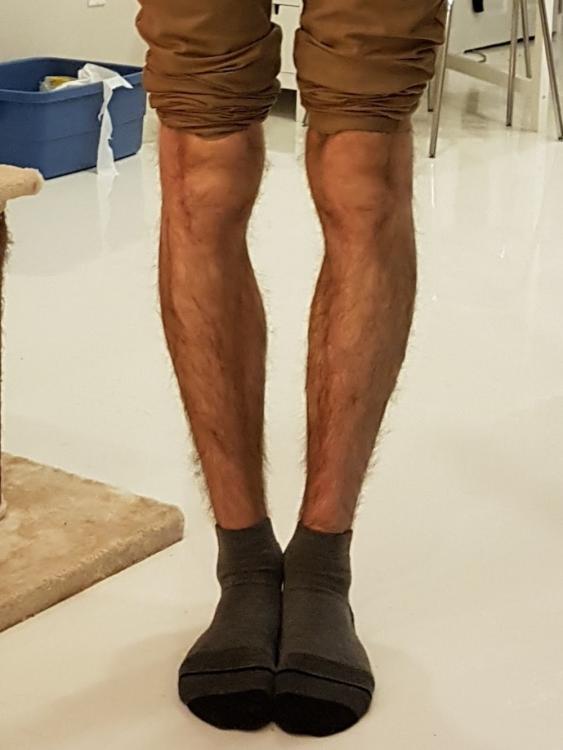
This screenshot has height=750, width=563. I want to click on white legs to a bar table, so click(543, 88).